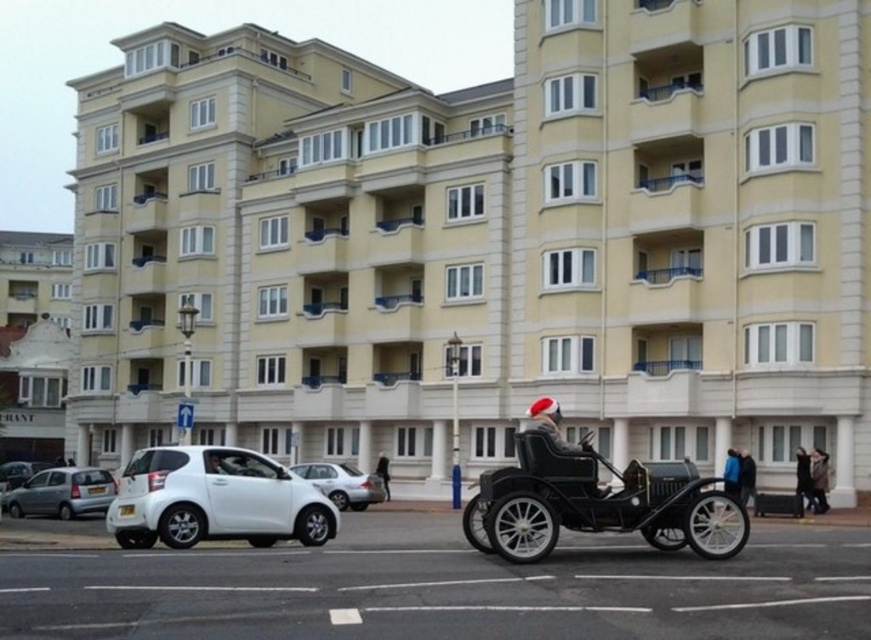
Is beige concrete building at center to the left of white matte car at lower left from the viewer's perspective?

No, beige concrete building at center is not to the left of white matte car at lower left.

Is point (105, 388) positioned after point (165, 502)?

Yes, point (105, 388) is behind point (165, 502).

Locate an element on the screen. The height and width of the screenshot is (640, 871). beige concrete building at center is located at coordinates (488, 237).

You are a GUI agent. You are given a task and a screenshot of the screen. Output one action in this format:
    pyautogui.click(x=<x>, y=<y>)
    Task: Click on the beige concrete building at center
    This screenshot has height=640, width=871.
    Given the screenshot: What is the action you would take?
    pyautogui.click(x=488, y=237)

Between point (277, 72) and point (809, 497), which one is positioned in front?

Point (809, 497) is in front.

Can you confirm if beige concrete building at center is bigger than dark gray coat at lower right?

Correct, beige concrete building at center is larger in size than dark gray coat at lower right.

Measure the distance between beige concrete building at center and camera.

beige concrete building at center is 50.79 meters away from camera.

You are a GUI agent. You are given a task and a screenshot of the screen. Output one action in this format:
    pyautogui.click(x=<x>, y=<y>)
    Task: Click on the beige concrete building at center
    This screenshot has width=871, height=640.
    Given the screenshot: What is the action you would take?
    pyautogui.click(x=488, y=237)

Can you confirm if santa hat leather jacket at center is positioned below dark gray coat at lower right?

Incorrect, santa hat leather jacket at center is not positioned below dark gray coat at lower right.

What do you see at coordinates (552, 422) in the screenshot? This screenshot has width=871, height=640. I see `santa hat leather jacket at center` at bounding box center [552, 422].

This screenshot has width=871, height=640. Describe the element at coordinates (552, 422) in the screenshot. I see `santa hat leather jacket at center` at that location.

At what (x,y) coordinates should I click in order to perform the action: click on santa hat leather jacket at center. Please return your answer as a coordinate pair (x, y). The image size is (871, 640). Looking at the image, I should click on (552, 422).